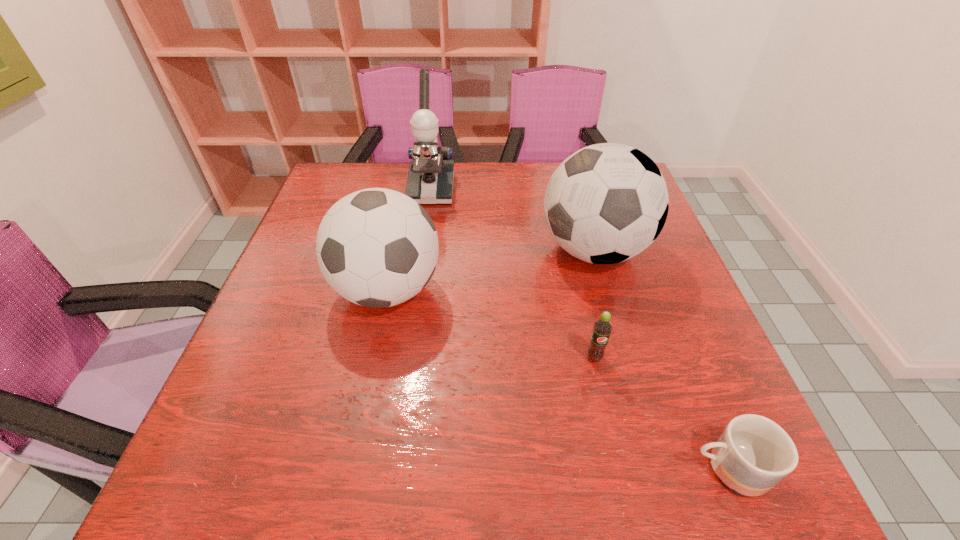
Where is `soccer ball at the right edge`? Image resolution: width=960 pixels, height=540 pixels. soccer ball at the right edge is located at coordinates (606, 203).

You are a GUI agent. You are given a task and a screenshot of the screen. Output one action in this format:
    pyautogui.click(x=<x>, y=<y>)
    Task: Click on the mug that is at the right edge
    The width and height of the screenshot is (960, 540).
    Given the screenshot: What is the action you would take?
    pyautogui.click(x=753, y=453)

Image resolution: width=960 pixels, height=540 pixels. I want to click on object present at the near right corner, so pyautogui.click(x=753, y=453).

Find the location of a particular element. The width and height of the screenshot is (960, 540). vacant region at the far edge is located at coordinates (383, 173).

In the image, there is a desktop. Where is `vacant region at the left edge`? vacant region at the left edge is located at coordinates (321, 209).

At what (x,y) coordinates should I click in order to perform the action: click on vacant space at the right edge of the desktop. Please return your answer as a coordinate pair (x, y). The width and height of the screenshot is (960, 540). Looking at the image, I should click on (692, 330).

The image size is (960, 540). I want to click on free space at the far left corner of the desktop, so click(372, 177).

Locate an element on the screen. free spot at the near left corner of the desktop is located at coordinates (283, 491).

The height and width of the screenshot is (540, 960). I want to click on vacant space in between the soda and the nearest object, so click(x=660, y=413).

Find the location of `free space between the soda and the shortest object`. free space between the soda and the shortest object is located at coordinates (660, 413).